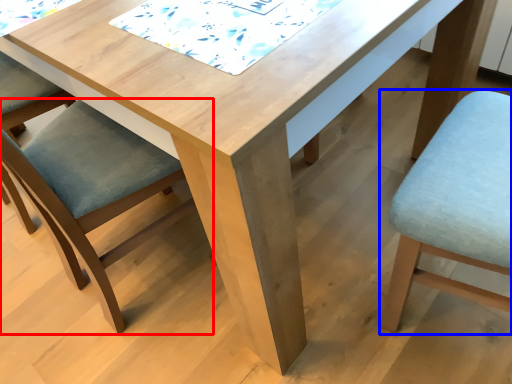
Question: Among these objects, which one is farthest to the camera, chair (highlighted by a red box) or chair (highlighted by a blue box)?

Choices:
 (A) chair
 (B) chair

Answer: (A)